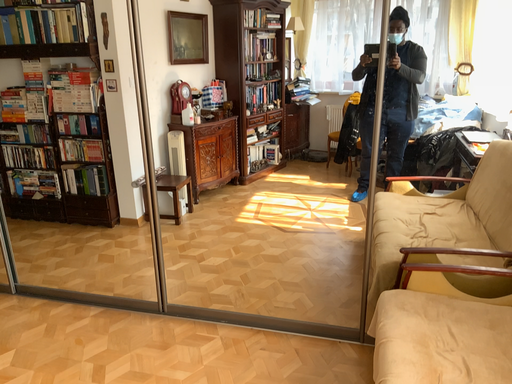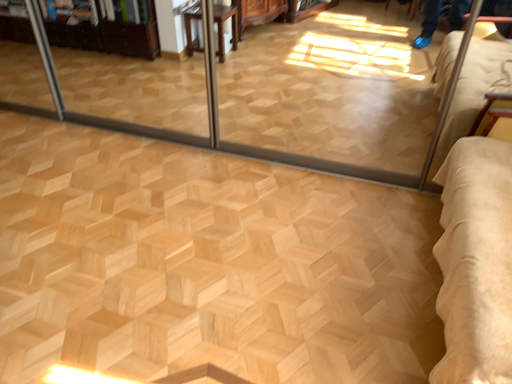
Question: Which way did the camera rotate in the video?

Choices:
 (A) rotated upward
 (B) rotated downward

Answer: (B)